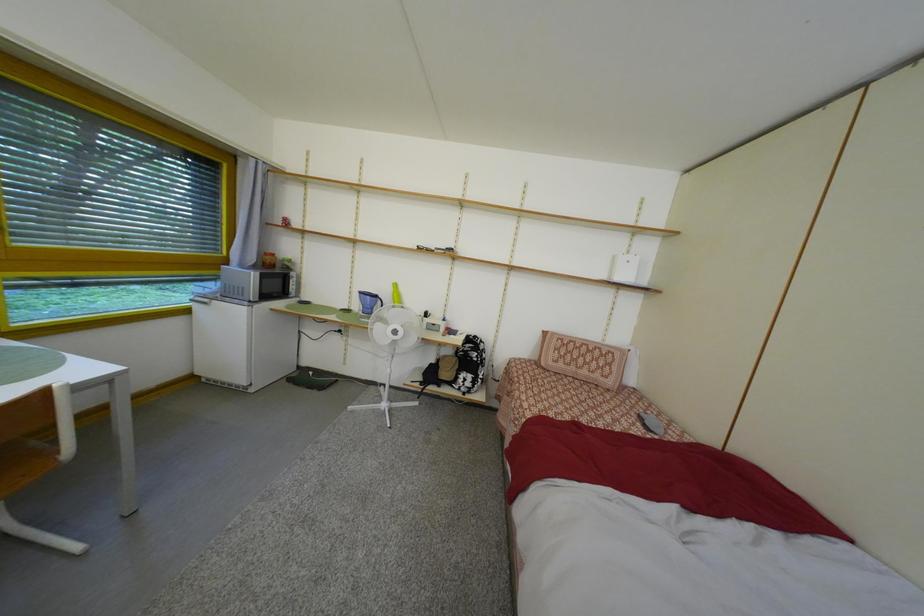
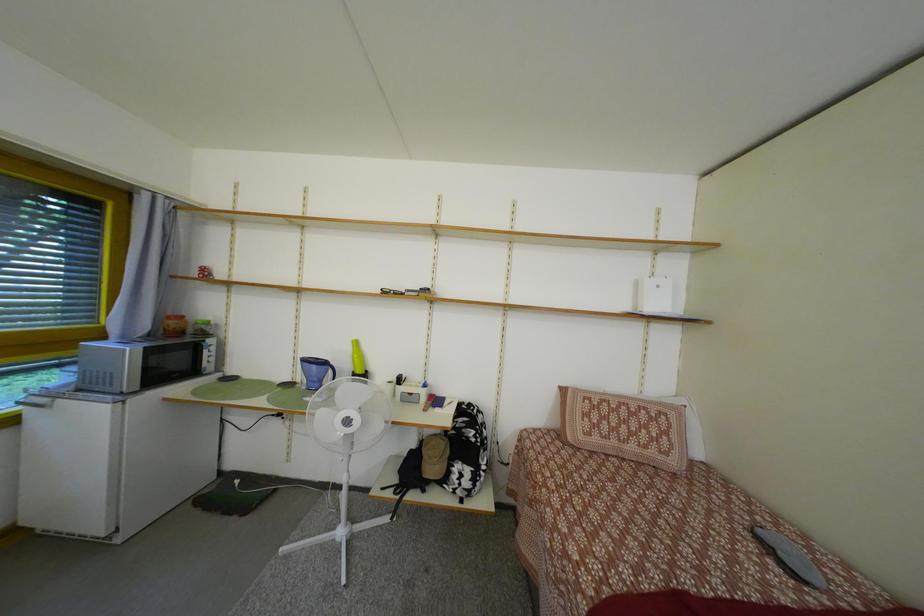
Question: Based on the continuous images, in which direction is the camera rotating? Reply with the corresponding letter.

Choices:
 (A) Left
 (B) Right
 (C) Up
 (D) Down

Answer: (C)